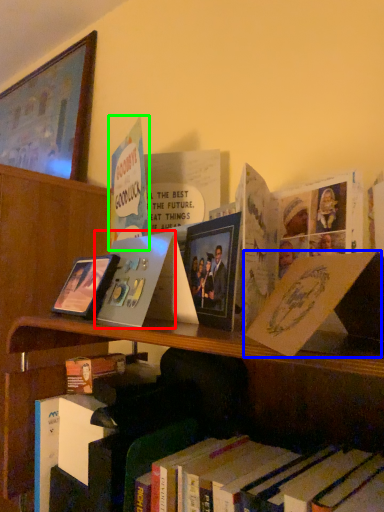
Question: Based on their relative distances, which object is farther from paperback book (highlighted by a red box)? Choose from paperback book (highlighted by a blue box) and book (highlighted by a green box).

Choices:
 (A) paperback book
 (B) book

Answer: (A)